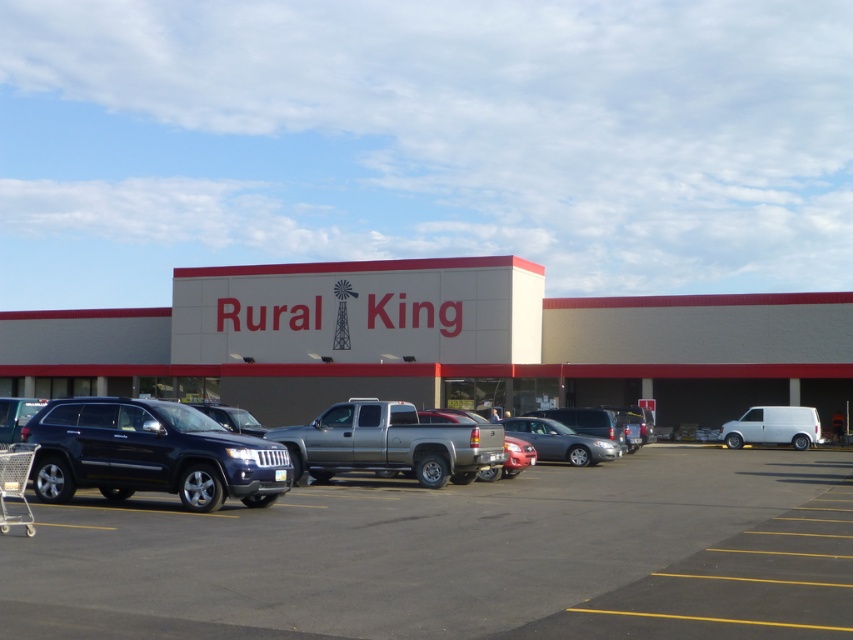
How distant is matte black suv at center from satin silver suv at center?

11.23 meters

Between matte black suv at center and satin silver suv at center, which one appears on the left side from the viewer's perspective?

From the viewer's perspective, matte black suv at center appears more on the left side.

Who is more distant from viewer, (293, 474) or (611, 412)?

The point (611, 412) is more distant.

Image resolution: width=853 pixels, height=640 pixels. I want to click on matte black suv at center, so click(387, 444).

Is point (577, 442) positioned in front of point (4, 470)?

No.

Is satin silver sedan at center to the left of metallic silver shopping cart at lower left from the viewer's perspective?

Incorrect, satin silver sedan at center is not on the left side of metallic silver shopping cart at lower left.

Which is in front, point (537, 424) or point (1, 468)?

Point (1, 468)

Find the location of a particular element. satin silver sedan at center is located at coordinates (560, 442).

The image size is (853, 640). Describe the element at coordinates (437, 342) in the screenshot. I see `beige concrete building at center` at that location.

Between point (251, 321) and point (764, 420), which one is positioned in front?

Point (764, 420)

Find the location of a particular element. beige concrete building at center is located at coordinates (437, 342).